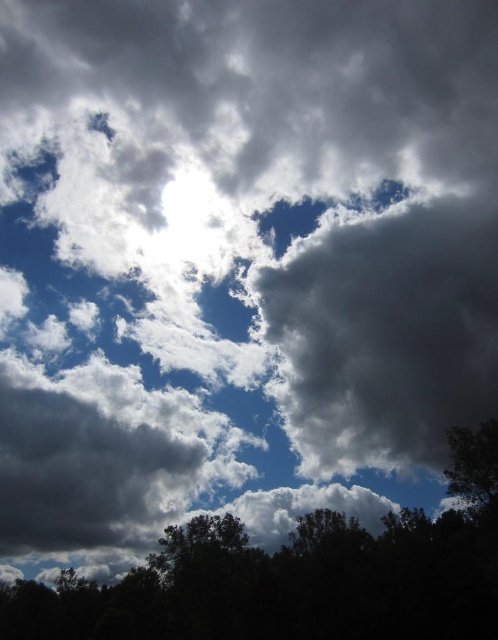
Question: Is dark gray fluffy cloud at upper center behind dark green leafy tree at bottom?

Choices:
 (A) yes
 (B) no

Answer: (A)

Question: Is dark gray fluffy cloud at upper center below dark green leafy tree at bottom?

Choices:
 (A) yes
 (B) no

Answer: (B)

Question: Among these objects, which one is nearest to the camera?

Choices:
 (A) dark green leafy tree at bottom
 (B) dark gray fluffy cloud at upper center

Answer: (A)

Question: Which point appears farthest from the camera in this image?

Choices:
 (A) (381, 353)
 (B) (313, 625)

Answer: (A)

Question: Is dark gray fluffy cloud at upper center to the left of dark green leafy tree at bottom from the viewer's perspective?

Choices:
 (A) yes
 (B) no

Answer: (B)